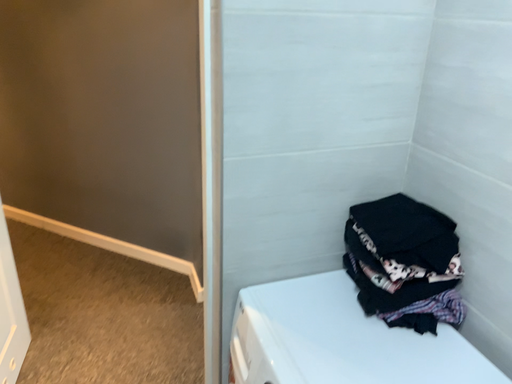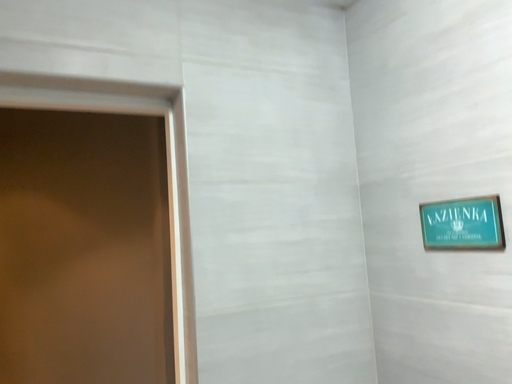
Question: How did the camera likely rotate when shooting the video?

Choices:
 (A) rotated downward
 (B) rotated upward

Answer: (B)